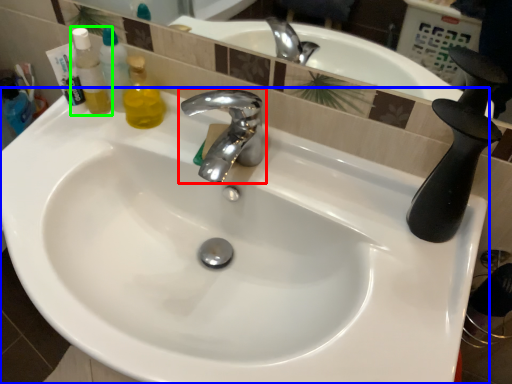
Question: Which is nearer to the tap (highlighted by a red box)? sink (highlighted by a blue box) or mouthwash (highlighted by a green box).

Choices:
 (A) sink
 (B) mouthwash

Answer: (A)